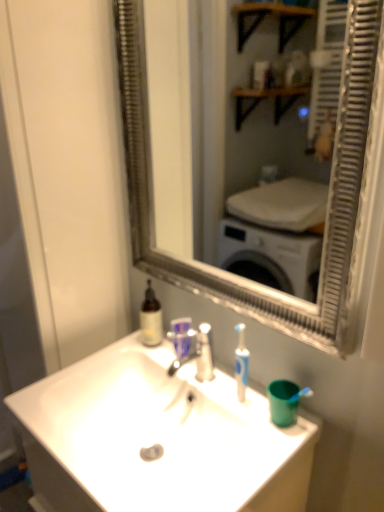
Locate an element on the screen. This screenshot has width=384, height=512. vacant space behind silver metallic faucet at center is located at coordinates tap(182, 364).